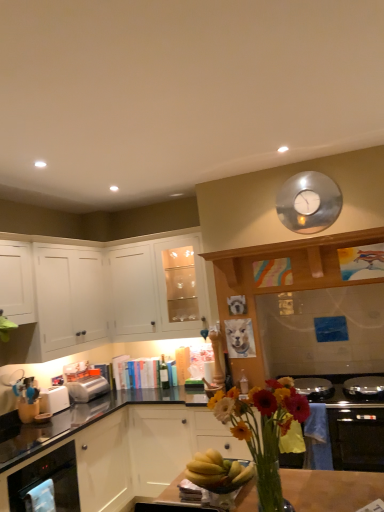
Question: From a real-world perspective, is silver metallic clock at upper center physically above white matte cabinet at upper left, the first cabinetry viewed from the top?

Choices:
 (A) no
 (B) yes

Answer: (B)

Question: From a real-world perspective, is silver metallic clock at upper center below white matte cabinet at upper left, the third cabinetry from the bottom?

Choices:
 (A) yes
 (B) no

Answer: (B)

Question: From the image's perspective, is silver metallic clock at upper center over white matte cabinet at upper left, the first cabinetry viewed from the top?

Choices:
 (A) yes
 (B) no

Answer: (A)

Question: Is silver metallic clock at upper center at the right side of white matte cabinet at upper left, the first cabinetry viewed from the top?

Choices:
 (A) no
 (B) yes

Answer: (B)

Question: Considering the relative sizes of silver metallic clock at upper center and white matte cabinet at upper left, the first cabinetry viewed from the top, in the image provided, is silver metallic clock at upper center bigger than white matte cabinet at upper left, the first cabinetry viewed from the top,?

Choices:
 (A) no
 (B) yes

Answer: (A)

Question: Can you confirm if silver metallic clock at upper center is smaller than white matte cabinet at upper left, the first cabinetry viewed from the top?

Choices:
 (A) yes
 (B) no

Answer: (A)

Question: From the image's perspective, is white plastic toaster at lower left, the 2th toaster in the back-to-front sequence, under stainless steel oven at lower left?

Choices:
 (A) yes
 (B) no

Answer: (B)

Question: Considering the relative sizes of white plastic toaster at lower left, the 2th toaster in the back-to-front sequence, and stainless steel oven at lower left in the image provided, is white plastic toaster at lower left, the 2th toaster in the back-to-front sequence, wider than stainless steel oven at lower left?

Choices:
 (A) yes
 (B) no

Answer: (B)

Question: Is the depth of white plastic toaster at lower left, the 2th toaster in the back-to-front sequence, greater than that of stainless steel oven at lower left?

Choices:
 (A) yes
 (B) no

Answer: (A)

Question: From a real-world perspective, is white plastic toaster at lower left, the 1th toaster from the front, on top of stainless steel oven at lower left?

Choices:
 (A) no
 (B) yes

Answer: (B)

Question: Is white plastic toaster at lower left, the 1th toaster from the front, bigger than stainless steel oven at lower left?

Choices:
 (A) no
 (B) yes

Answer: (A)

Question: Considering the relative sizes of white plastic toaster at lower left, the 1th toaster from the front, and stainless steel oven at lower left in the image provided, is white plastic toaster at lower left, the 1th toaster from the front, taller than stainless steel oven at lower left?

Choices:
 (A) yes
 (B) no

Answer: (B)

Question: Is satin silver toaster at lower left, the first toaster from the back, facing away from white matte cabinet at left, which is the first cabinetry in bottom-to-top order?

Choices:
 (A) no
 (B) yes

Answer: (B)